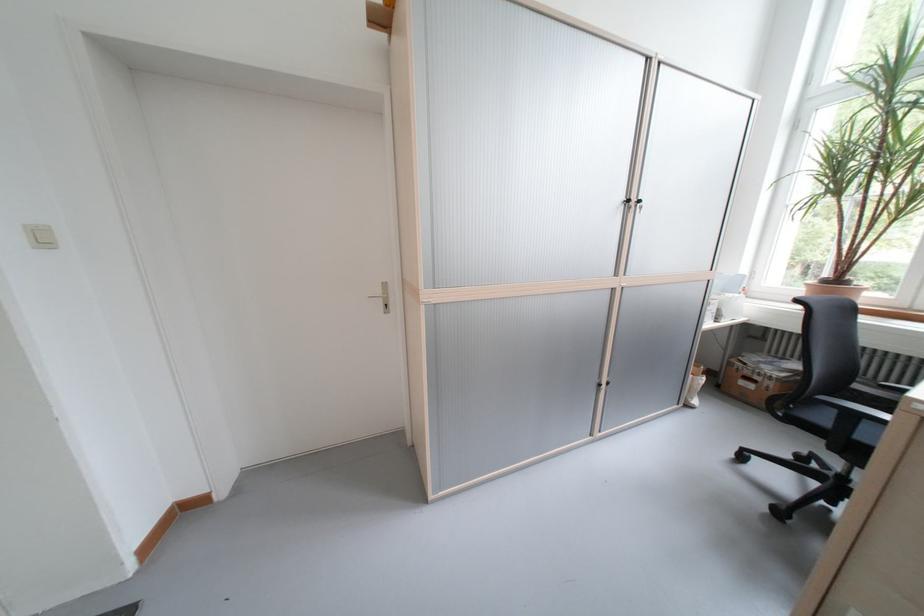
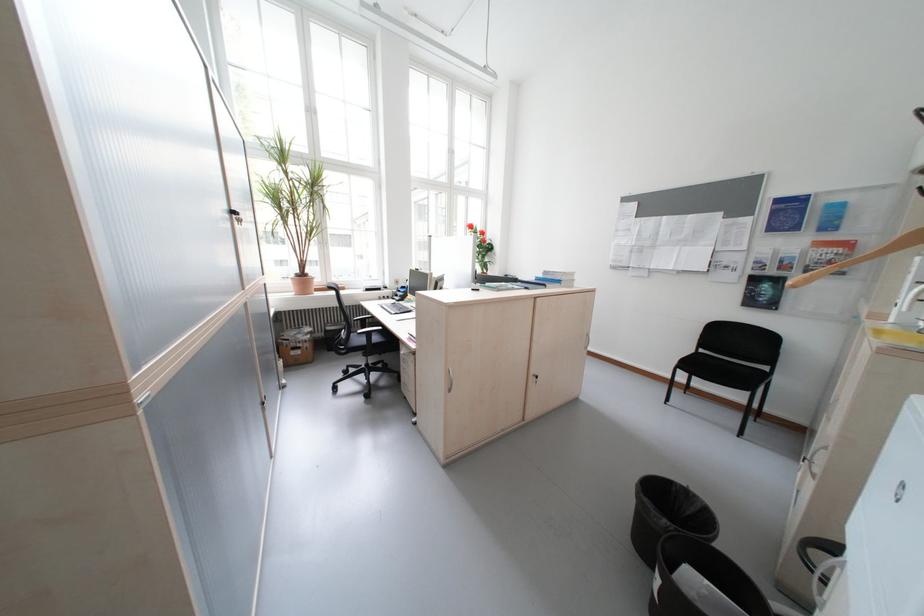
In the second image, find the point that corresponds to point 834,283 in the first image.

(308, 277)